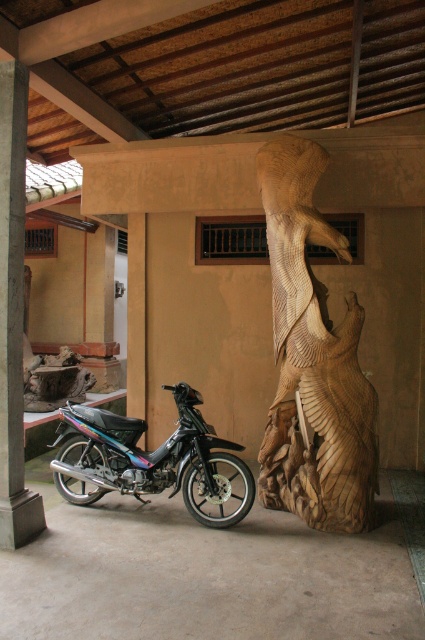
Who is more distant from viewer, (348,358) or (159,472)?

The point (159,472) is behind.

Is point (320, 288) positioned before point (76, 445)?

Yes, point (320, 288) is in front of point (76, 445).

This screenshot has height=640, width=425. Find the location of `wooden carving of bird at right`. wooden carving of bird at right is located at coordinates (312, 358).